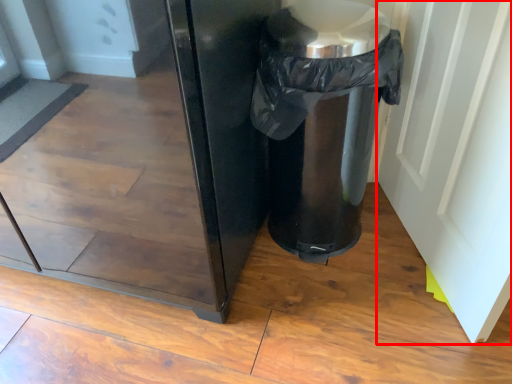
Question: In this image, where is screen door (annotated by the red box) located relative to waste container?

Choices:
 (A) left
 (B) right

Answer: (B)